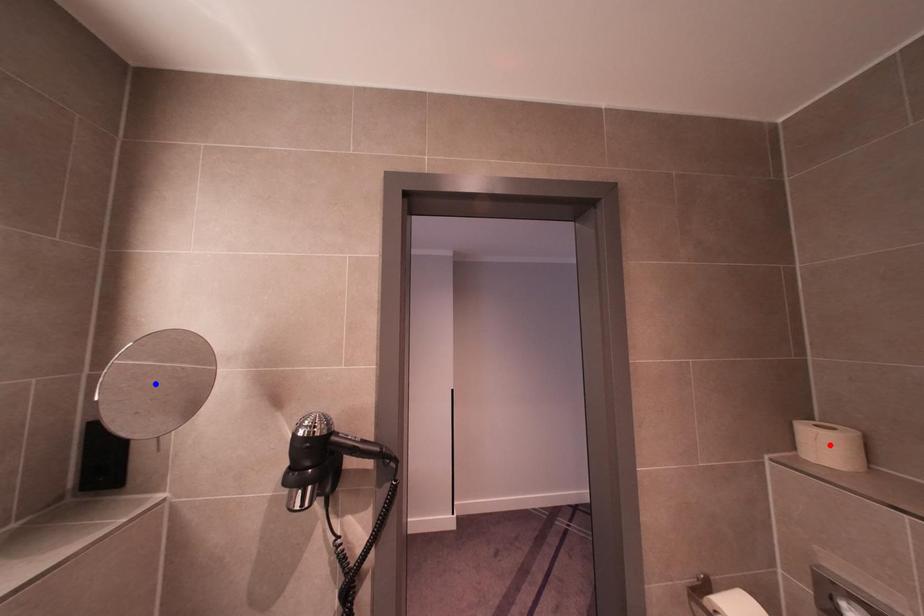
Question: Which of the two points in the image is closer to the camera?

Choices:
 (A) Blue point is closer.
 (B) Red point is closer.

Answer: (A)